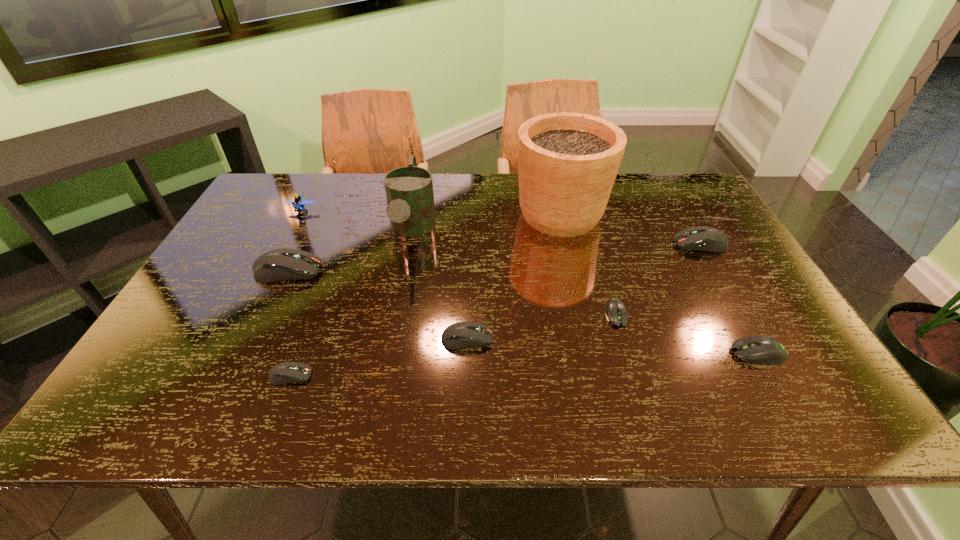
The width and height of the screenshot is (960, 540). I want to click on vacant area that lies between the third farthest dark computer equipment and the farthest computer mouse, so click(584, 292).

Image resolution: width=960 pixels, height=540 pixels. In order to click on the eighth closest object to the fifth nearest computer mouse in this screenshot , I will do `click(765, 350)`.

Locate which object is the closest to the second farthest dark computer equipment. Please provide its 2D coordinates. Your answer should be formatted as a tuple, i.e. [(x, y)], where the tuple contains the x and y coordinates of a point satisfying the conditions above.

[(409, 190)]

Find the location of `computer mouse object that ranks as the second closest to the nearest object`. computer mouse object that ranks as the second closest to the nearest object is located at coordinates (460, 335).

Choose which computer mouse is the third nearest neighbor to the farthest computer mouse. Please provide its 2D coordinates. Your answer should be formatted as a tuple, i.e. [(x, y)], where the tuple contains the x and y coordinates of a point satisfying the conditions above.

[(460, 335)]

Point out which dark computer equipment is positioned as the fourth nearest to the sixth object from right to left. Please provide its 2D coordinates. Your answer should be formatted as a tuple, i.e. [(x, y)], where the tuple contains the x and y coordinates of a point satisfying the conditions above.

[(703, 238)]

Point out which dark computer equipment is positioned as the nearest to the tallest computer mouse. Please provide its 2D coordinates. Your answer should be formatted as a tuple, i.e. [(x, y)], where the tuple contains the x and y coordinates of a point satisfying the conditions above.

[(286, 372)]

Identify the location of free space that satisfies the following two spatial constraints: 1. with the spout on the green watering can; 2. on the button of the second farthest computer mouse. (404, 271).

Image resolution: width=960 pixels, height=540 pixels. Find the location of `vacant space that satisfies the following two spatial constraints: 1. on the button of the third smallest dark computer equipment; 2. on the wheel side of the smaller gray computer mouse`. vacant space that satisfies the following two spatial constraints: 1. on the button of the third smallest dark computer equipment; 2. on the wheel side of the smaller gray computer mouse is located at coordinates (741, 314).

Where is `free space that satisfies the following two spatial constraints: 1. on the wheel side of the farther gray computer mouse; 2. on the button of the nearest computer mouse`? free space that satisfies the following two spatial constraints: 1. on the wheel side of the farther gray computer mouse; 2. on the button of the nearest computer mouse is located at coordinates (635, 376).